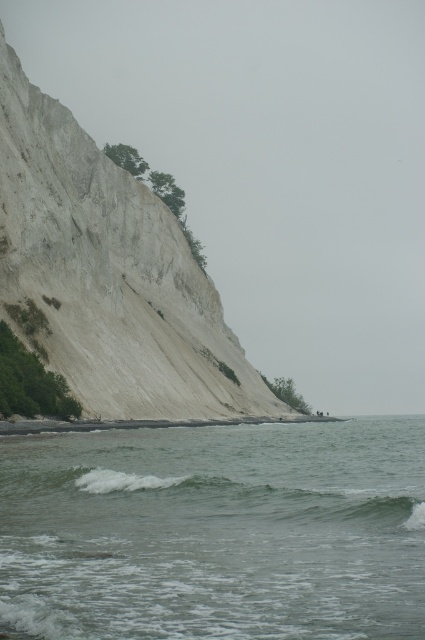
Based on the photo, you are a hiker standing at the base of the white sandy cliff at upper left. You want to walk to the greenish water at lower center. Is the path directly in front of you uphill or downhill?

The path directly in front of you is downhill because the greenish water at lower center is shorter than the white sandy cliff at upper left, meaning you would be descending towards the water.